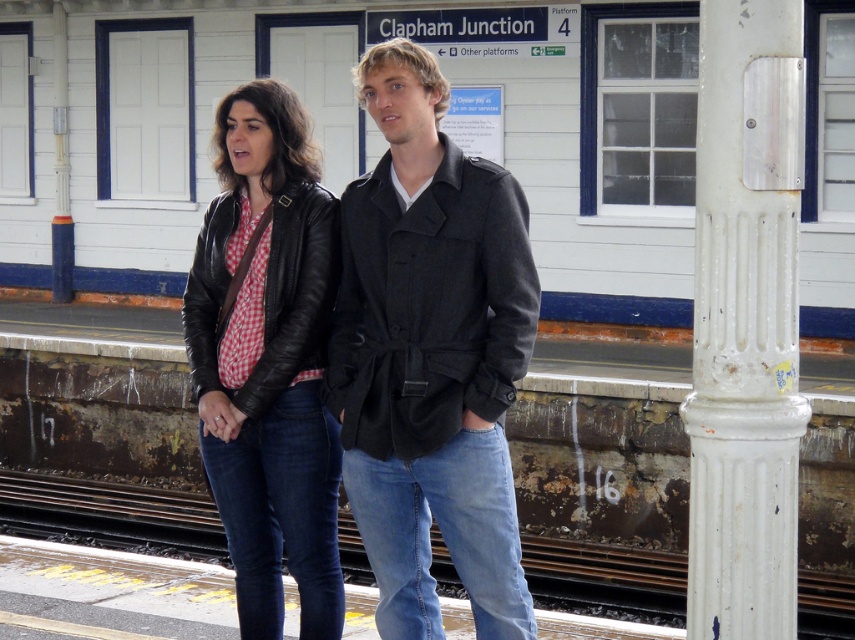
You are a photographer trying to capture a shot of the leather jacket at center and the rusty metal train track at lower center. Based on their positions, which object is closer to the left side of your camera frame?

The leather jacket at center is to the left of the rusty metal train track at lower center, so it is closer to the left side of the camera frame.

You are a photographer on the platform and want to take a photo of the leather jacket at center and the white painted metal pole at right. Which object is positioned lower in the image?

The leather jacket at center is positioned lower than the white painted metal pole at right.

You are a fashion designer observing two jackets on a person at Clapham Junction station. You see the matte black jacket at center and the leather jacket at center. Which jacket is worn over the other?

The matte black jacket at center is located above the leather jacket at center, so the matte black jacket at center is worn over the leather jacket at center.